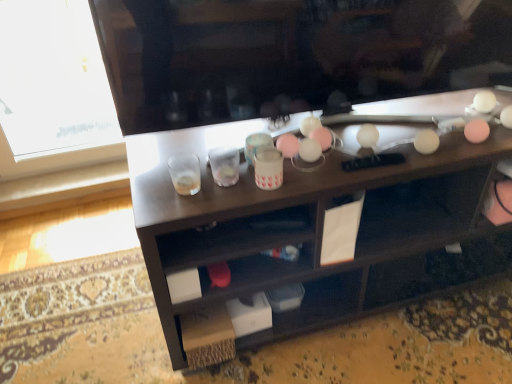
Where is `space that is in front of translucent glass at center, placed as the first shot glass when sorted from left to right`? space that is in front of translucent glass at center, placed as the first shot glass when sorted from left to right is located at coordinates (180, 208).